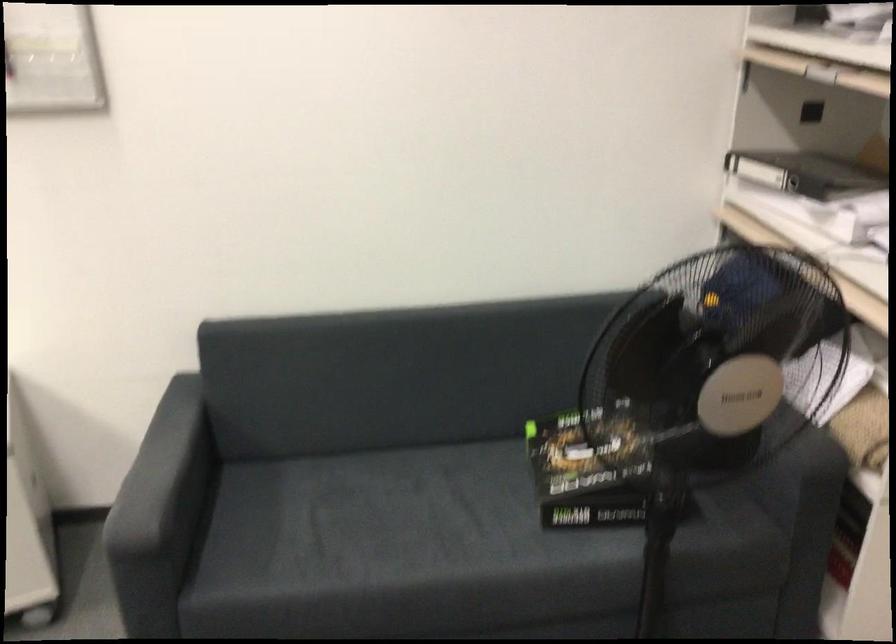
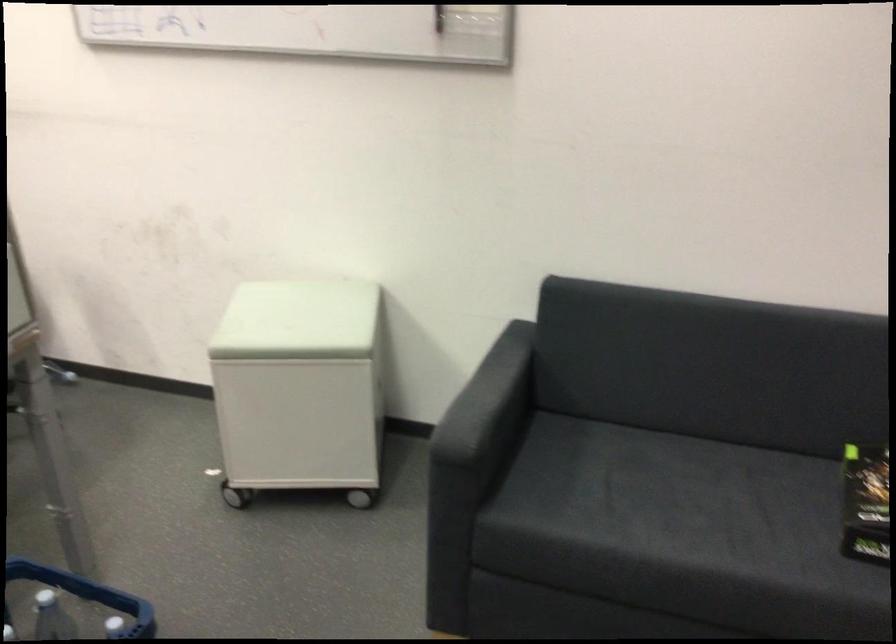
Locate, in the second image, the point that corresponds to point (552, 471) in the first image.

(866, 503)